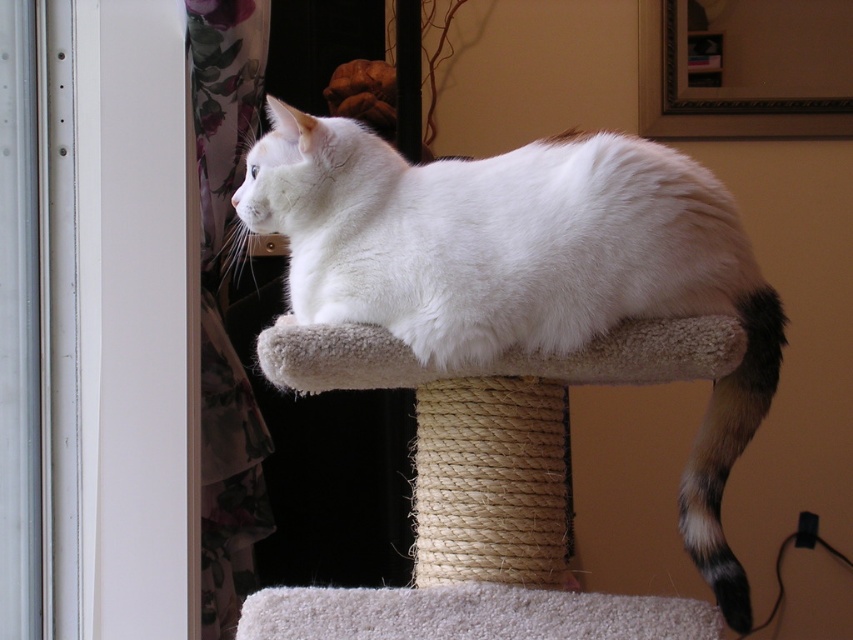
How much distance is there between white fluffy cat at center and black and white fur tail at right?

A distance of 7.26 inches exists between white fluffy cat at center and black and white fur tail at right.

Who is shorter, white fluffy cat at center or black and white fur tail at right?

black and white fur tail at right

Where is `white fluffy cat at center`? The height and width of the screenshot is (640, 853). white fluffy cat at center is located at coordinates (525, 268).

Find the location of a particular element. This screenshot has height=640, width=853. white fluffy cat at center is located at coordinates (525, 268).